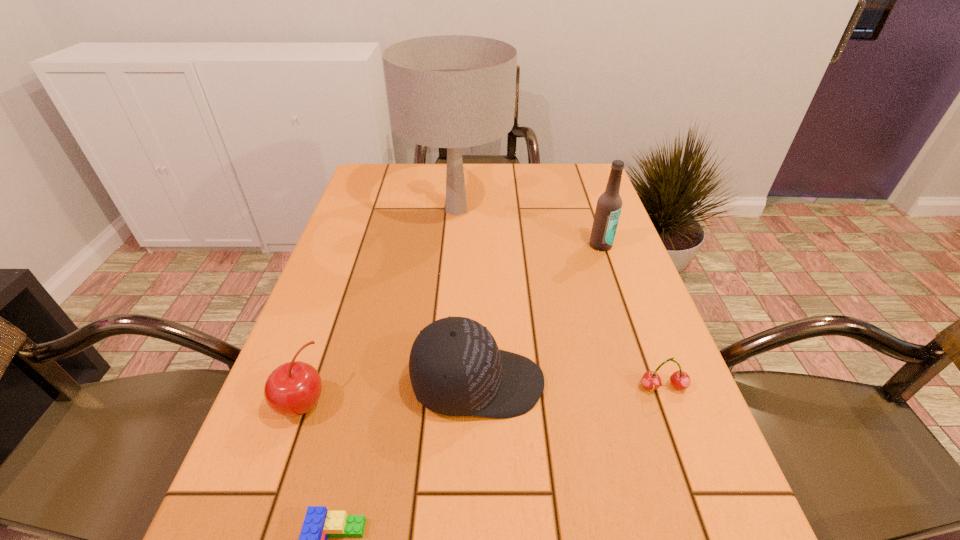
Locate an element on the screen. free point located 0.340m on the right of the third shortest object is located at coordinates (511, 402).

Locate an element on the screen. The width and height of the screenshot is (960, 540). vacant space located with stems pointing upwards on the shorter cherry is located at coordinates (706, 501).

This screenshot has width=960, height=540. I want to click on object situated at the far edge, so click(448, 91).

At what (x,y) coordinates should I click in order to perform the action: click on object present at the left edge. Please return your answer as a coordinate pair (x, y). This screenshot has height=540, width=960. Looking at the image, I should click on (292, 389).

The height and width of the screenshot is (540, 960). I want to click on beer bottle that is at the right edge, so click(x=608, y=209).

Locate an element on the screen. cherry that is at the right edge is located at coordinates (680, 380).

The width and height of the screenshot is (960, 540). What are the coordinates of `vacant space at the far edge` in the screenshot? It's located at (424, 179).

At what (x,y) coordinates should I click in order to perform the action: click on free location at the left edge. Please return your answer as a coordinate pair (x, y). Image resolution: width=960 pixels, height=540 pixels. Looking at the image, I should click on (300, 492).

At what (x,y) coordinates should I click in order to perform the action: click on free space at the right edge of the desktop. Please return your answer as a coordinate pair (x, y). This screenshot has height=540, width=960. Looking at the image, I should click on (x=678, y=536).

You are a GUI agent. You are given a task and a screenshot of the screen. Output one action in this format:
    pyautogui.click(x=<x>, y=<y>)
    Task: Click on the free location at the far left corner of the desktop
    The height and width of the screenshot is (540, 960).
    Given the screenshot: What is the action you would take?
    pyautogui.click(x=397, y=185)